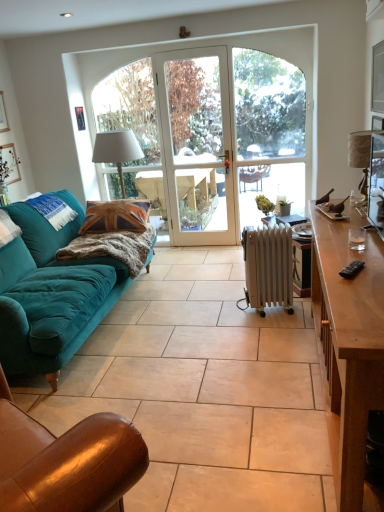
Question: Can you confirm if teal velvet pillow at left is positioned to the right of white fabric lampshade at center, which is counted as the second lamp, starting from the front?

Choices:
 (A) no
 (B) yes

Answer: (A)

Question: Is teal velvet pillow at left surrounding white fabric lampshade at center, which appears as the second lamp when viewed from the right?

Choices:
 (A) no
 (B) yes

Answer: (A)

Question: Is teal velvet pillow at left to the left of white fabric lampshade at center, which is counted as the second lamp, starting from the front, from the viewer's perspective?

Choices:
 (A) no
 (B) yes

Answer: (B)

Question: Is teal velvet pillow at left next to white fabric lampshade at center, the 1th lamp from the left?

Choices:
 (A) yes
 (B) no

Answer: (B)

Question: Is teal velvet pillow at left looking in the opposite direction of white fabric lampshade at center, the first lamp positioned from the back?

Choices:
 (A) yes
 (B) no

Answer: (B)

Question: Is brown wooden desk at right spatially inside brown leather chair at lower left, or outside of it?

Choices:
 (A) inside
 (B) outside

Answer: (B)

Question: From their relative heights in the image, would you say brown wooden desk at right is taller or shorter than brown leather chair at lower left?

Choices:
 (A) tall
 (B) short

Answer: (B)

Question: Considering the positions of brown wooden desk at right and brown leather chair at lower left in the image, is brown wooden desk at right wider or thinner than brown leather chair at lower left?

Choices:
 (A) thin
 (B) wide

Answer: (B)

Question: From the image's perspective, is brown wooden desk at right located above or below brown leather chair at lower left?

Choices:
 (A) below
 (B) above

Answer: (B)

Question: From a real-world perspective, is white glass screen door at center above or below white fabric lampshade at center, which is counted as the second lamp, starting from the front?

Choices:
 (A) above
 (B) below

Answer: (A)

Question: From the image's perspective, relative to white fabric lampshade at center, which is counted as the second lamp, starting from the front, is white glass screen door at center above or below?

Choices:
 (A) above
 (B) below

Answer: (A)

Question: Visually, is white glass screen door at center positioned to the left or to the right of white fabric lampshade at center, the 1th lamp from the left?

Choices:
 (A) left
 (B) right

Answer: (B)

Question: Is white glass screen door at center bigger or smaller than white fabric lampshade at center, the first lamp positioned from the back?

Choices:
 (A) big
 (B) small

Answer: (A)

Question: Considering their positions, is brown leather chair at lower left located in front of or behind brown wooden desk at right?

Choices:
 (A) behind
 (B) front

Answer: (B)

Question: Considering the positions of brown leather chair at lower left and brown wooden desk at right in the image, is brown leather chair at lower left wider or thinner than brown wooden desk at right?

Choices:
 (A) wide
 (B) thin

Answer: (B)